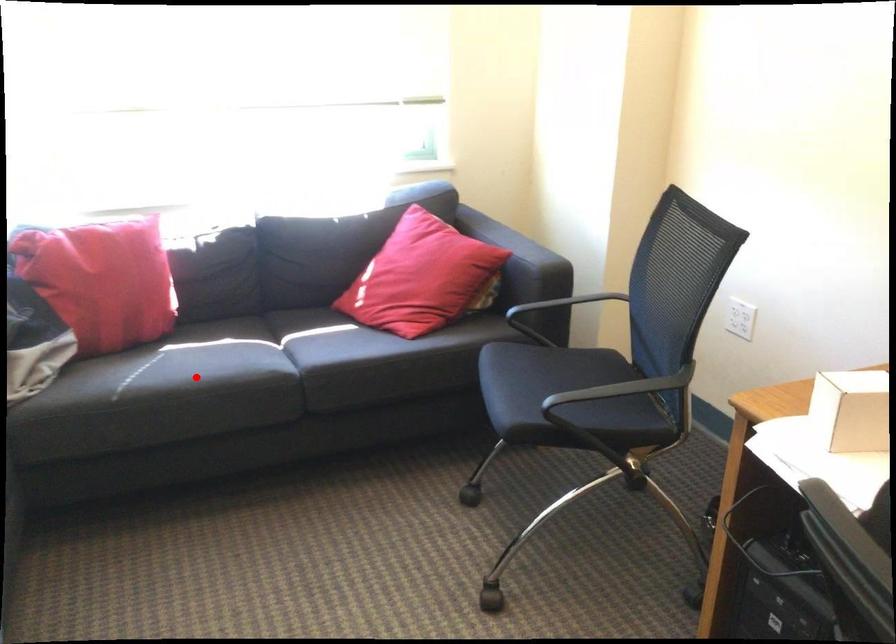
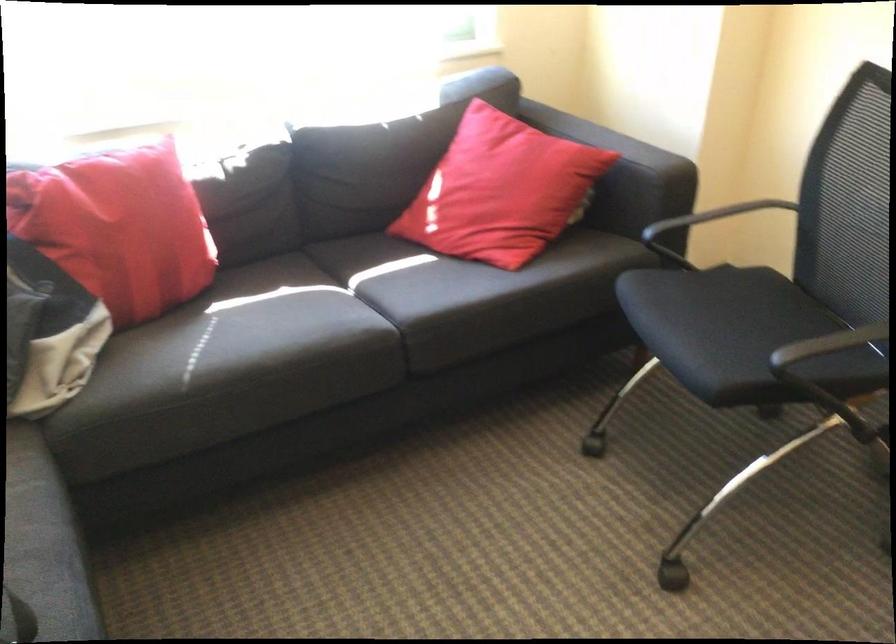
In the second image, find the point that corresponds to the highlighted location in the first image.

(280, 346)